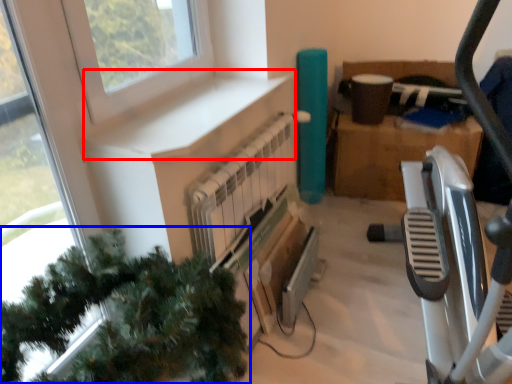
Question: Which object is closer to the camera taking this photo, window sill (highlighted by a red box) or christmas tree (highlighted by a blue box)?

Choices:
 (A) window sill
 (B) christmas tree

Answer: (B)